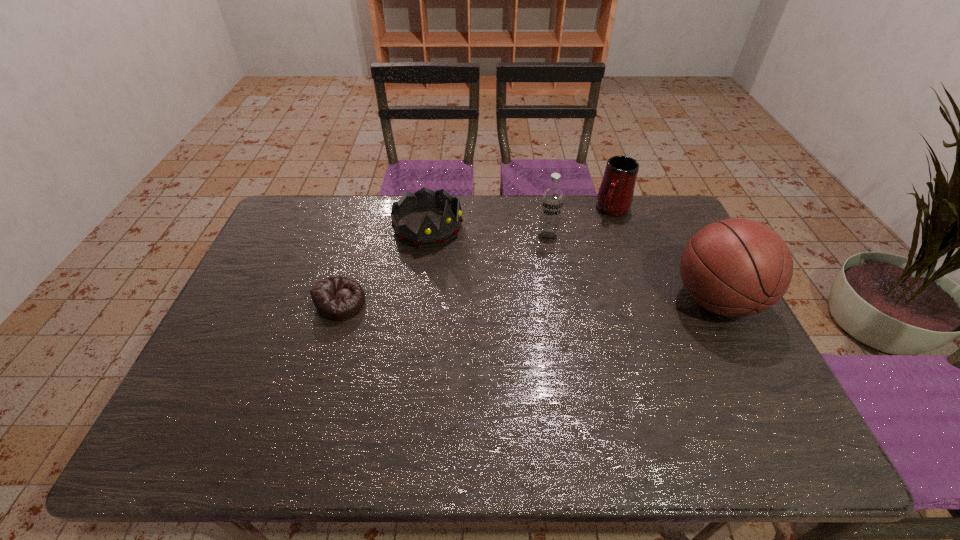
The image size is (960, 540). I want to click on free space on the desktop that is between the shortest object and the rightmost object and is positioned at the front of the tiara with jewels, so click(534, 302).

You are a GUI agent. You are given a task and a screenshot of the screen. Output one action in this format:
    pyautogui.click(x=<x>, y=<y>)
    Task: Click on the vacant space on the desktop that is between the beanbag and the basketball and is positioned on the front label of the third object from left to right
    This screenshot has width=960, height=540.
    Given the screenshot: What is the action you would take?
    pyautogui.click(x=518, y=302)

This screenshot has height=540, width=960. In order to click on vacant space on the desktop that is between the shortest object and the basketball and is positioned on the side of the mug with the handle in this screenshot , I will do `click(555, 301)`.